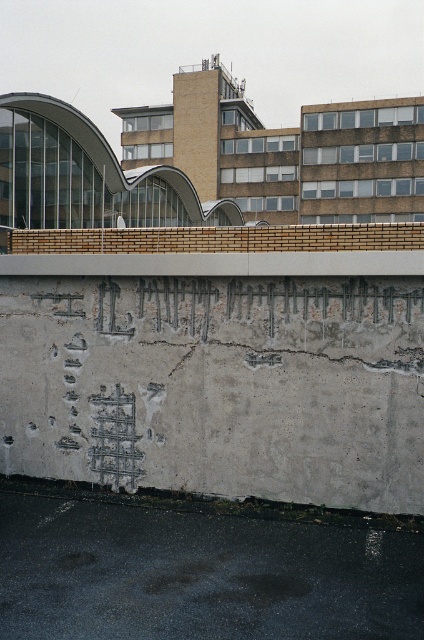
Consider the image. Which of these two, gray concrete wall at center or gray concrete at lower center, stands shorter?

Standing shorter between the two is gray concrete at lower center.

Does point (242, 374) come farther from viewer compared to point (345, 557)?

Yes, point (242, 374) is behind point (345, 557).

I want to click on gray concrete wall at center, so click(x=217, y=385).